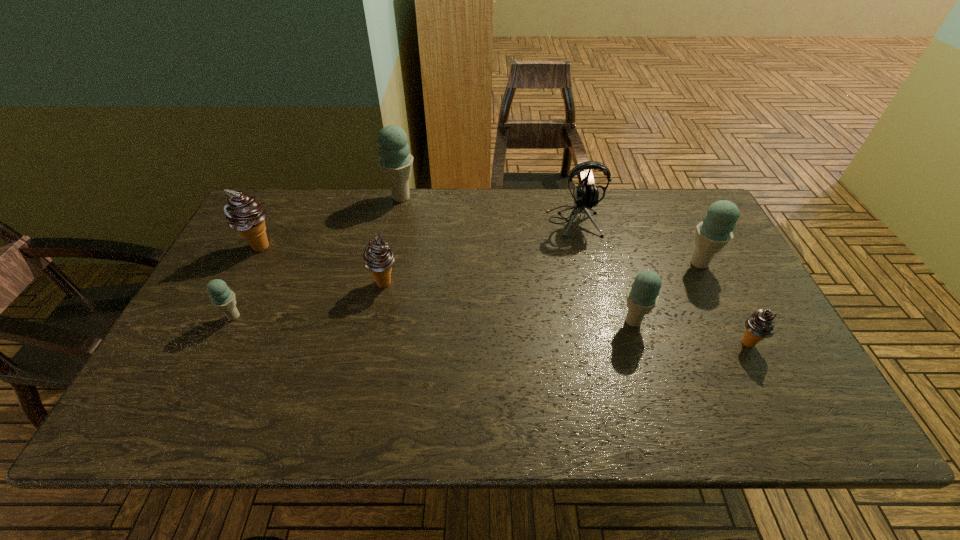
What are the coordinates of `the second blue ice cream from right to left` in the screenshot? It's located at (642, 296).

This screenshot has height=540, width=960. What are the coordinates of `the rightmost chocolate icecream` in the screenshot? It's located at (760, 325).

Locate an element on the screen. Image resolution: width=960 pixels, height=540 pixels. the smallest chocolate icecream is located at coordinates tap(760, 325).

Where is `the smallest blue ice cream`? The width and height of the screenshot is (960, 540). the smallest blue ice cream is located at coordinates (221, 296).

Find the location of `vacant space situated 0.120m on the right of the farthest blue ice cream`. vacant space situated 0.120m on the right of the farthest blue ice cream is located at coordinates (454, 198).

The image size is (960, 540). Identify the location of free space located on the right of the black earphone. (657, 221).

Identify the location of free space located 0.400m on the right of the leftmost chocolate icecream. (413, 246).

Find the location of a particular element. blank space located on the front of the third nearest blue ice cream is located at coordinates (722, 308).

Identify the location of free space located on the back of the second chocolate icecream from left to right. This screenshot has height=540, width=960. tap(396, 228).

The image size is (960, 540). In order to click on vacant space located 0.050m on the left of the second blue ice cream from right to left in this screenshot , I will do `click(598, 321)`.